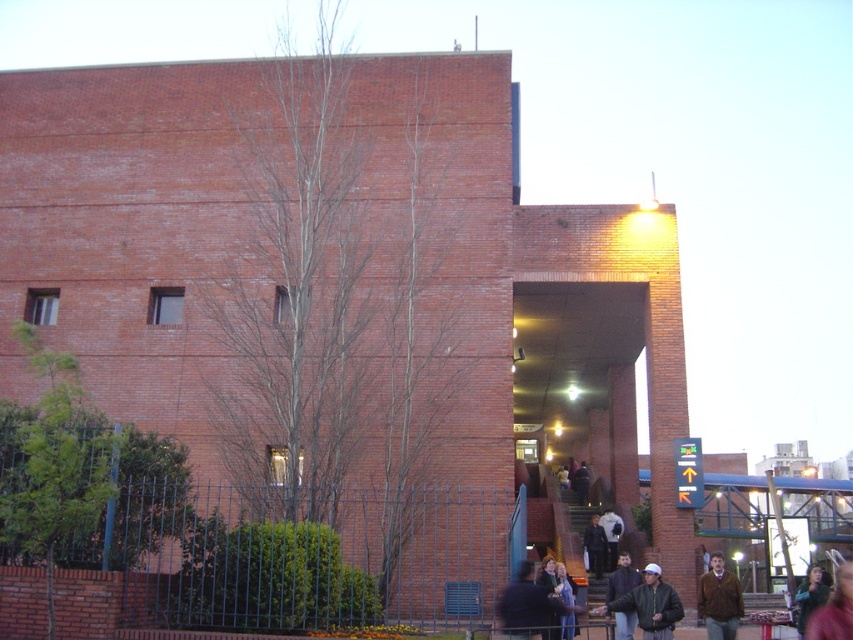
You are a security guard standing at the entrance of the building. You notice two jackets hanging on a rack near the entrance. Which jacket is closer to you, the light brown leather jacket at lower center or the white matte jacket at lower center?

The light brown leather jacket at lower center is closer to you since it is in front of the white matte jacket at lower center.

You are a fashion designer observing two jackets displayed at a store. The jackets are the light brown leather jacket at lower center and the white matte jacket at lower center. Which jacket is thinner?

The light brown leather jacket at lower center is thinner than the white matte jacket at lower center according to the description.